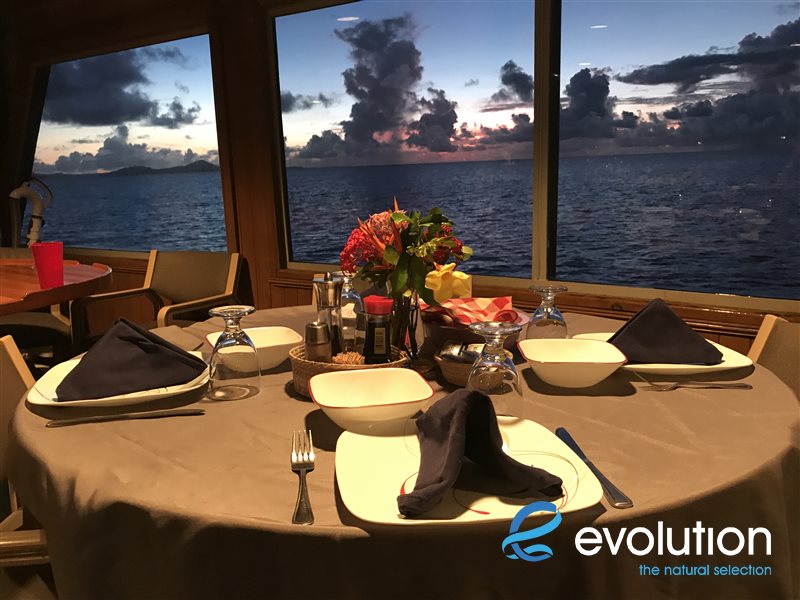
The height and width of the screenshot is (600, 800). I want to click on bouquet, so click(x=402, y=230).